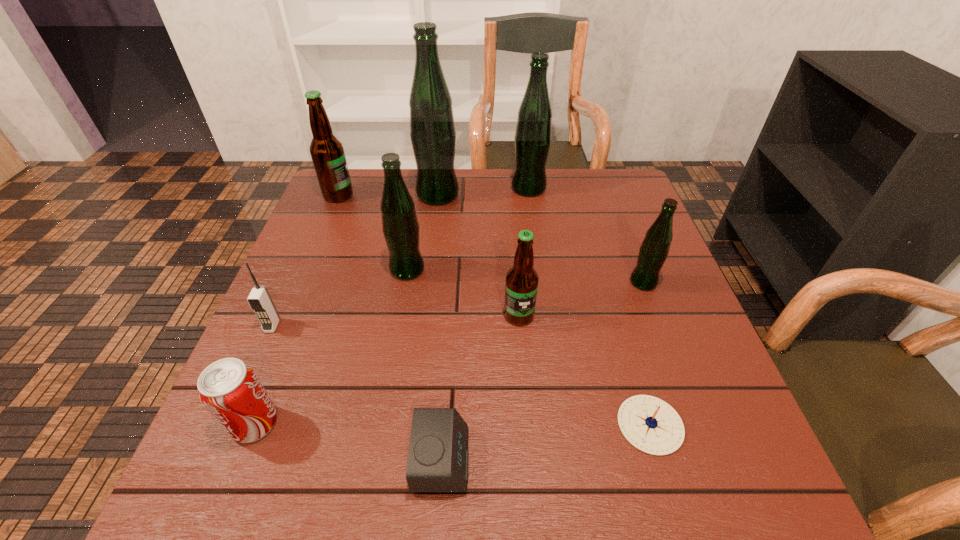
Find the location of a particular element. the tallest beer bottle is located at coordinates (432, 129).

Image resolution: width=960 pixels, height=540 pixels. Identify the location of the tallest object. (432, 129).

The height and width of the screenshot is (540, 960). I want to click on the second tallest object, so click(x=532, y=140).

Image resolution: width=960 pixels, height=540 pixels. What are the coordinates of `the second green beer bottle from right to left` in the screenshot? It's located at (532, 140).

You are a GUI agent. You are given a task and a screenshot of the screen. Output one action in this format:
    pyautogui.click(x=<x>, y=<y>)
    Task: Click on the left brown beer bottle
    This screenshot has width=960, height=540.
    Given the screenshot: What is the action you would take?
    pyautogui.click(x=327, y=152)

Where is `the farther brown beer bottle`? The image size is (960, 540). the farther brown beer bottle is located at coordinates [327, 152].

Identify the location of the third biggest green beer bottle. (400, 226).

Locate an element on the screen. the nearest beer bottle is located at coordinates (521, 285).

Locate an element on the screen. Image resolution: width=960 pixels, height=540 pixels. the smaller brown beer bottle is located at coordinates (521, 285).

The width and height of the screenshot is (960, 540). I want to click on the rightmost beer bottle, so click(653, 252).